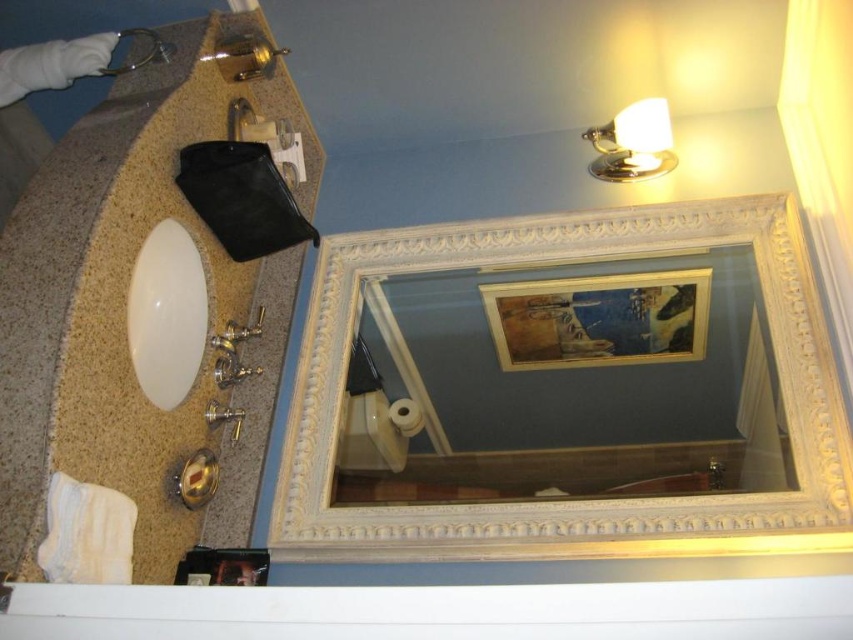
You are designing a layout for a bathroom and need to ensure that the white carved wood mirror at upper center and the brushed metal faucet at upper left will fit within a 1.2 meter wide space. Based on their widths, can both items fit side by side?

The white carved wood mirror at upper center is wider than the brushed metal faucet at upper left. However, since the total width of both items combined is not provided, it is impossible to determine if they will fit within the 1.2 meter space without additional information about their individual dimensions.

You are a plumber inspecting the bathroom vanity. You need to access the water supply line for the brushed metal faucet at upper left. Can you easily reach it without moving the white glossy sink at left?

The white glossy sink at left is in front of the brushed metal faucet at upper left, so moving the sink would be necessary to access the faucet components behind it.